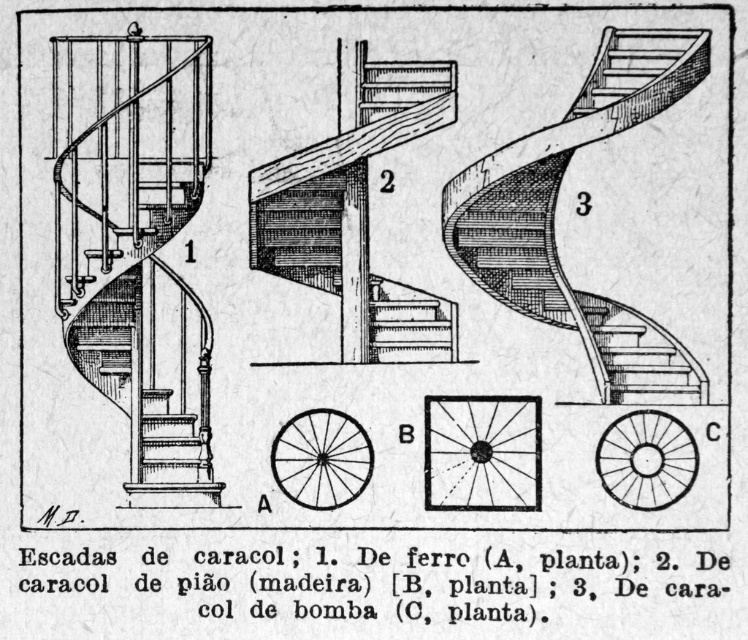
Question: Is wooden staircase at center bigger than black wood spiral staircase at center?

Choices:
 (A) no
 (B) yes

Answer: (B)

Question: Which of these objects is positioned closest to the metallic silver gear at center?

Choices:
 (A) black wood spiral staircase at center
 (B) transparent glass sunburst at center
 (C) wooden staircase at center
 (D) wooden stairs at center

Answer: (D)

Question: Is black wood spiral staircase at center below wooden stairs at center?

Choices:
 (A) yes
 (B) no

Answer: (A)

Question: Which of these objects is positioned closest to the wooden stairs at center?

Choices:
 (A) black wood spiral staircase at center
 (B) wooden staircase at center
 (C) transparent glass sunburst at center

Answer: (C)

Question: Which of these objects is positioned farthest from the black wood spiral staircase at center?

Choices:
 (A) wooden staircase at center
 (B) transparent glass sunburst at center
 (C) wooden stairs at center

Answer: (C)

Question: Does transparent glass sunburst at center appear on the left side of metallic silver gear at center?

Choices:
 (A) no
 (B) yes

Answer: (A)